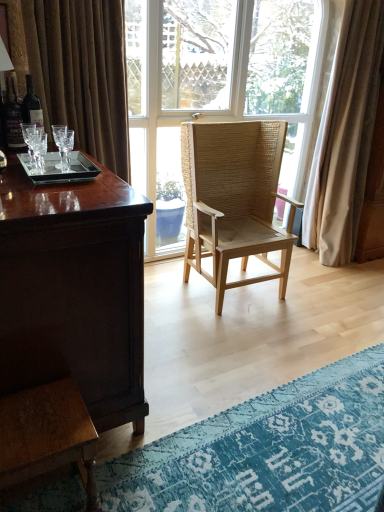
Where is `vacant space in front of beige fabric curtain at right`? Image resolution: width=384 pixels, height=512 pixels. vacant space in front of beige fabric curtain at right is located at coordinates (344, 279).